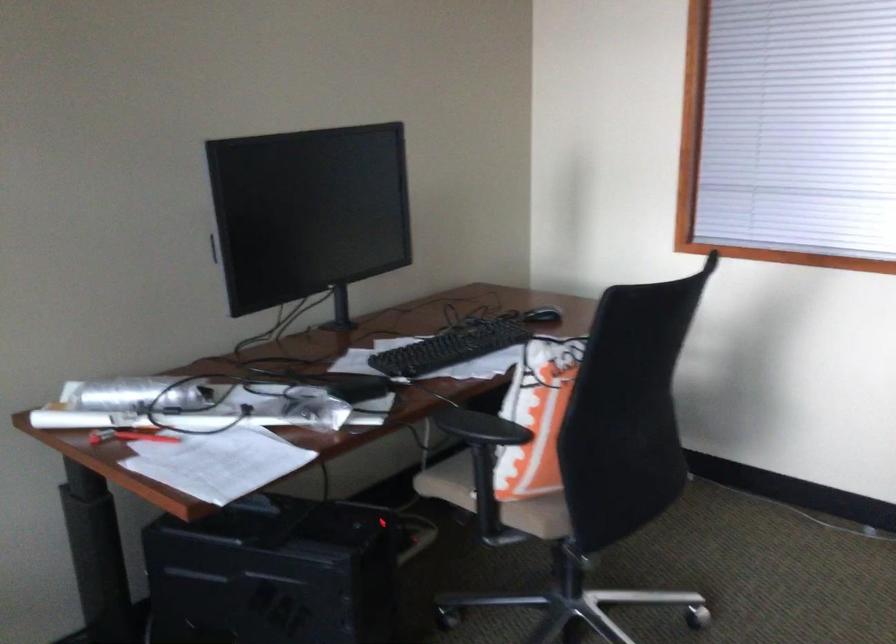
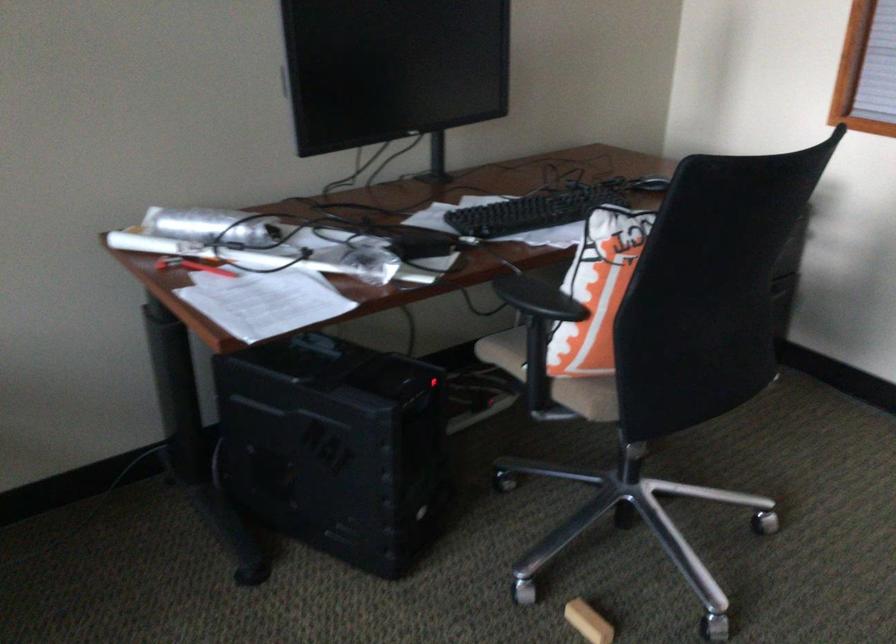
Where in the second image is the point corresponding to (487,427) from the first image?

(538, 299)